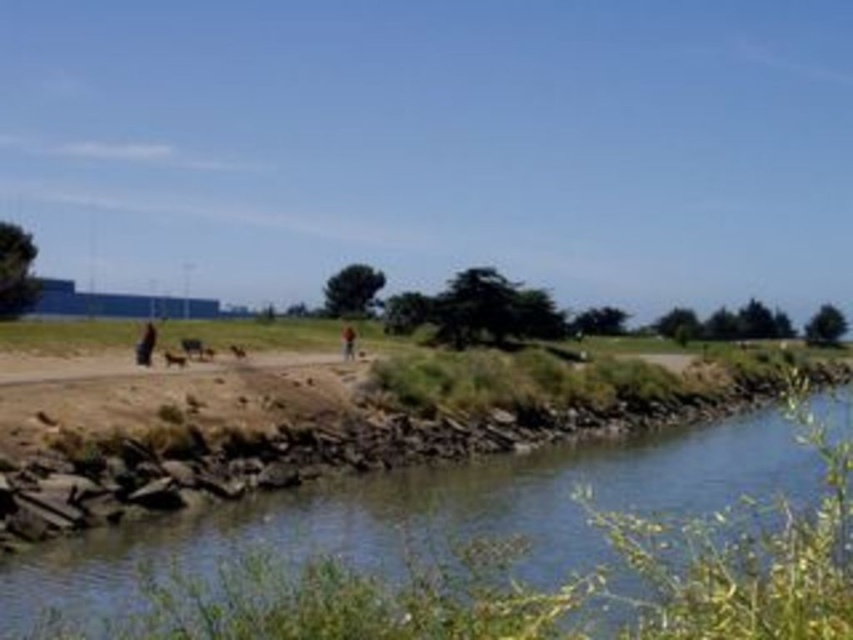
You are standing at the dark blue jeans at center and want to throw a pebble into the clear water at lower left. If you can throw a pebble 25 meters, will it reach the water?

The clear water at lower left is 28.24 meters from dark blue jeans at center. Since your throw can only reach 25 meters, the pebble will not reach the water.

You are a photographer standing in the park and notice the clear water at lower left and the dark blue jeans at center. Which object is positioned lower in the scene?

The clear water at lower left is positioned lower than the dark blue jeans at center.

You are standing at the edge of the water and need to cross to the other side. The clear water at lower left and dark blue jeans at center are in your path. Which object is taller and could potentially block your view when crossing?

The clear water at lower left is taller than the dark blue jeans at center, so it could potentially block your view more when crossing.